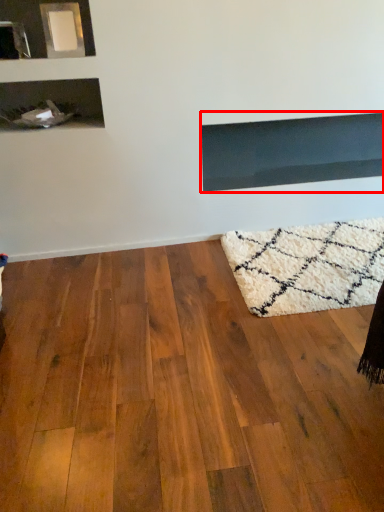
Question: Observing the image, what is the correct spatial positioning of fireplace (annotated by the red box) in reference to hardwood?

Choices:
 (A) right
 (B) left

Answer: (A)